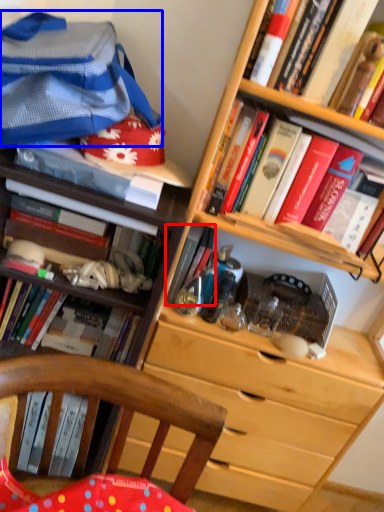
Question: Which point is closer to the camera, book (highlighted by a red box) or clothing (highlighted by a blue box)?

Choices:
 (A) book
 (B) clothing

Answer: (B)